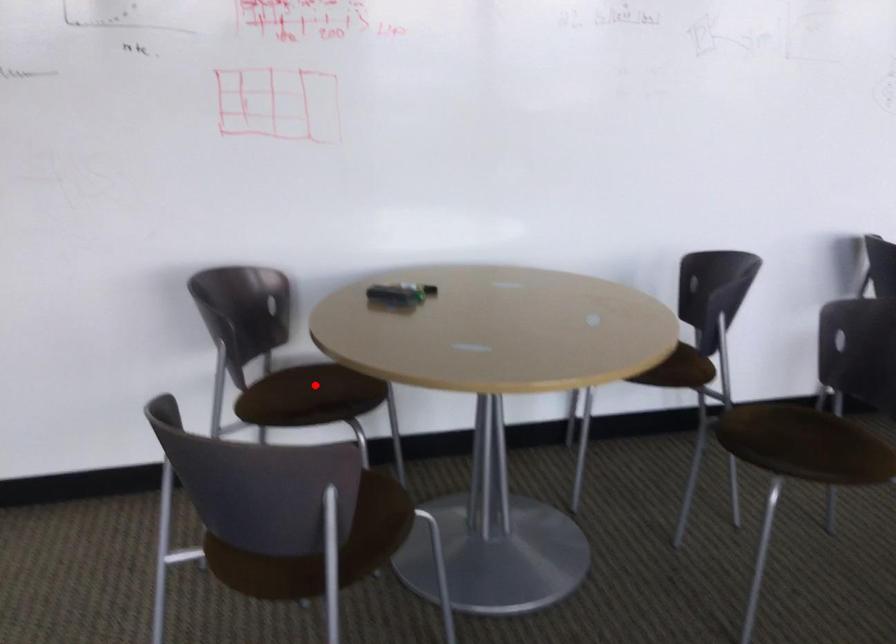
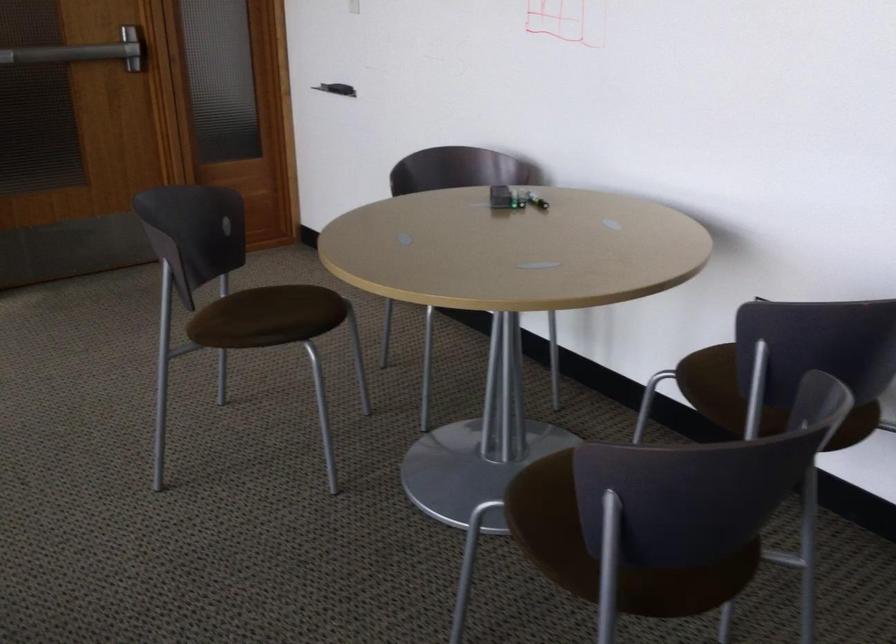
Question: I am providing you with two images of the same scene from different viewpoints. A red point is marked on the first image. At the location where the point appears in image 1, is it still visible in image 2?

Choices:
 (A) Yes
 (B) No

Answer: (B)